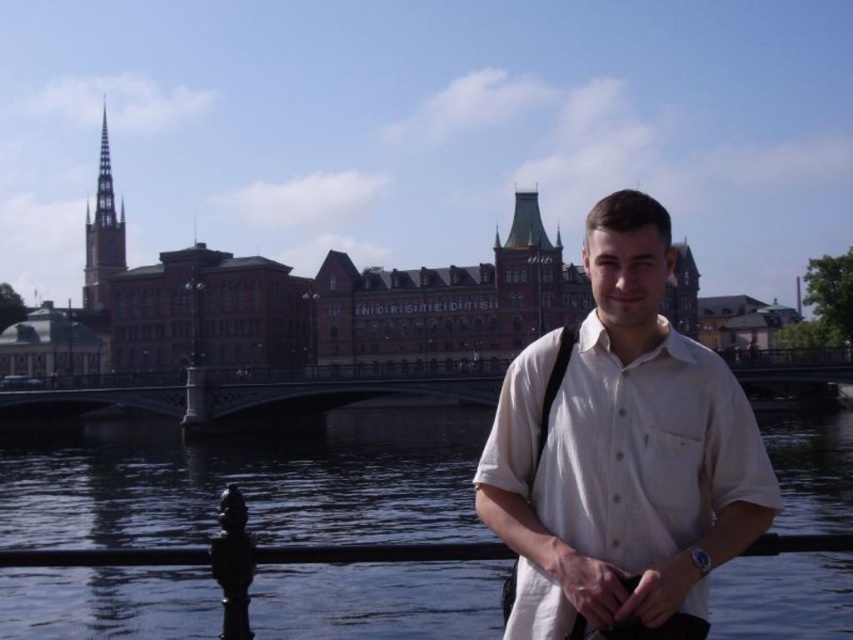
Who is positioned more to the right, transparent glass water at center or white cotton shirt at center?

Positioned to the right is white cotton shirt at center.

Looking at this image, does transparent glass water at center have a greater height compared to white cotton shirt at center?

No.

Between point (91, 483) and point (705, 518), which one is positioned behind?

The point (91, 483) is more distant.

Find the location of a particular element. The image size is (853, 640). transparent glass water at center is located at coordinates (248, 483).

Can you confirm if white cotton shirt at center is thinner than black metal rail at lower center?

Yes, white cotton shirt at center is thinner than black metal rail at lower center.

Who is more distant from viewer, (621, 394) or (218, 554)?

The point (218, 554) is behind.

The height and width of the screenshot is (640, 853). I want to click on white cotton shirt at center, so pos(622,449).

Can you confirm if transparent glass water at center is positioned to the left of black metal rail at lower center?

No, transparent glass water at center is not to the left of black metal rail at lower center.

What do you see at coordinates (248, 483) in the screenshot? I see `transparent glass water at center` at bounding box center [248, 483].

Who is more forward, (347, 419) or (281, 554)?

Point (281, 554) is more forward.

Where is `transparent glass water at center`? Image resolution: width=853 pixels, height=640 pixels. transparent glass water at center is located at coordinates (248, 483).